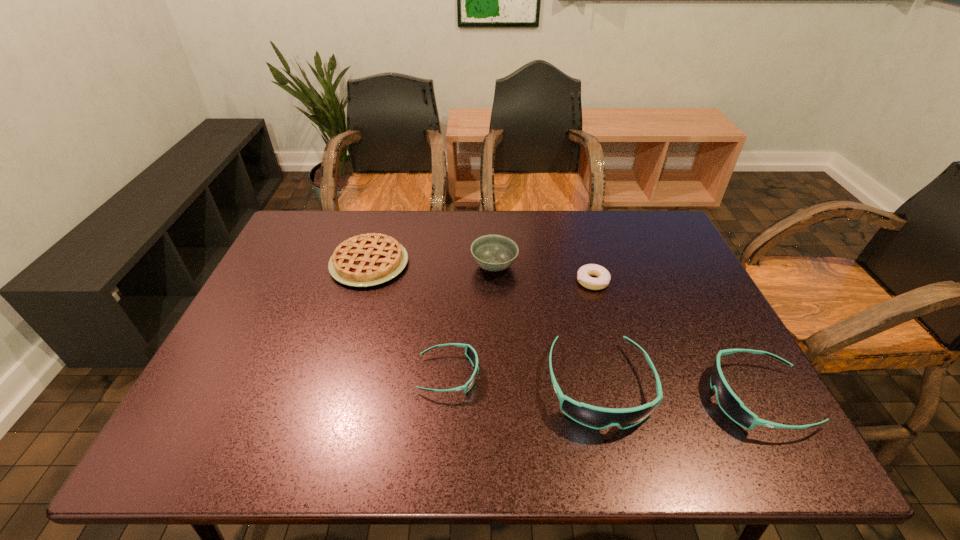
Please point a spot to add another sunglasses on the left. Please provide its 2D coordinates. Your answer should be formatted as a tuple, i.e. [(x, y)], where the tuple contains the x and y coordinates of a point satisfying the conditions above.

[(305, 363)]